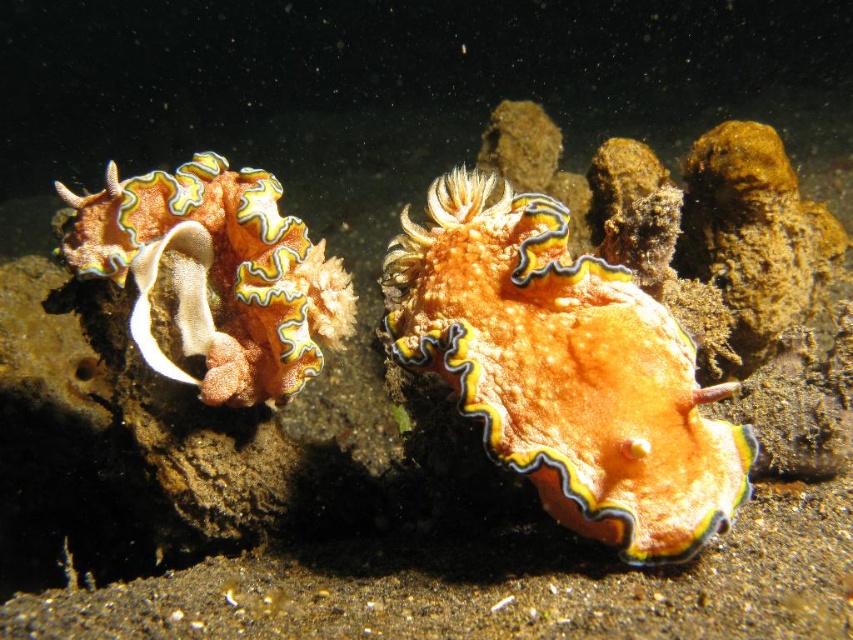
Question: Is orange matte sea slug at center below orange matte coral at left?

Choices:
 (A) no
 (B) yes

Answer: (B)

Question: Is the position of orange matte sea slug at center more distant than that of orange matte coral at left?

Choices:
 (A) no
 (B) yes

Answer: (A)

Question: Is orange matte sea slug at center positioned at the back of orange matte coral at left?

Choices:
 (A) yes
 (B) no

Answer: (B)

Question: Which object appears closest to the camera in this image?

Choices:
 (A) orange matte coral at left
 (B) orange matte sea slug at center

Answer: (B)

Question: Which of the following is the closest to the observer?

Choices:
 (A) orange matte sea slug at center
 (B) orange matte coral at left

Answer: (A)